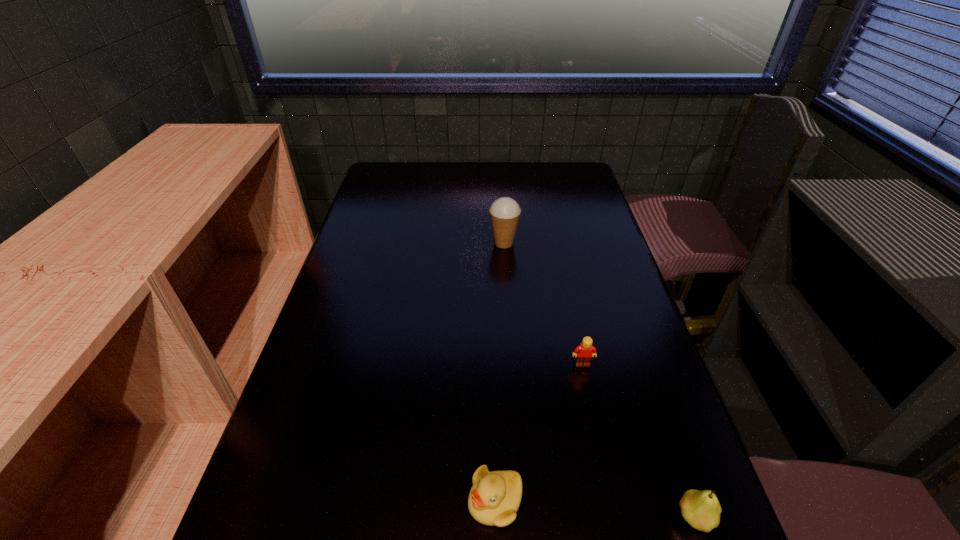
Where is `the tallest object`? The width and height of the screenshot is (960, 540). the tallest object is located at coordinates (505, 212).

The image size is (960, 540). In order to click on icecream in this screenshot , I will do `click(505, 212)`.

Locate an element on the screen. The image size is (960, 540). pear is located at coordinates (701, 509).

The image size is (960, 540). Find the location of `the rightmost object`. the rightmost object is located at coordinates (701, 509).

Locate an element on the screen. The image size is (960, 540). Lego is located at coordinates (584, 352).

You are a GUI agent. You are given a task and a screenshot of the screen. Output one action in this format:
    pyautogui.click(x=<x>, y=<y>)
    Task: Click on the second object from right to left
    Image resolution: width=960 pixels, height=540 pixels.
    Given the screenshot: What is the action you would take?
    pyautogui.click(x=584, y=352)

Find the location of `duckling`. duckling is located at coordinates (494, 498).

Locate an element on the screen. This screenshot has height=540, width=960. free region located 0.290m on the right of the farthest object is located at coordinates (612, 243).

Identify the location of vacant space positioned 0.090m on the back of the second tallest object. This screenshot has height=540, width=960. (672, 451).

Find the location of a particular element. This screenshot has height=540, width=960. free space located 0.230m on the face of the third nearest object is located at coordinates (605, 466).